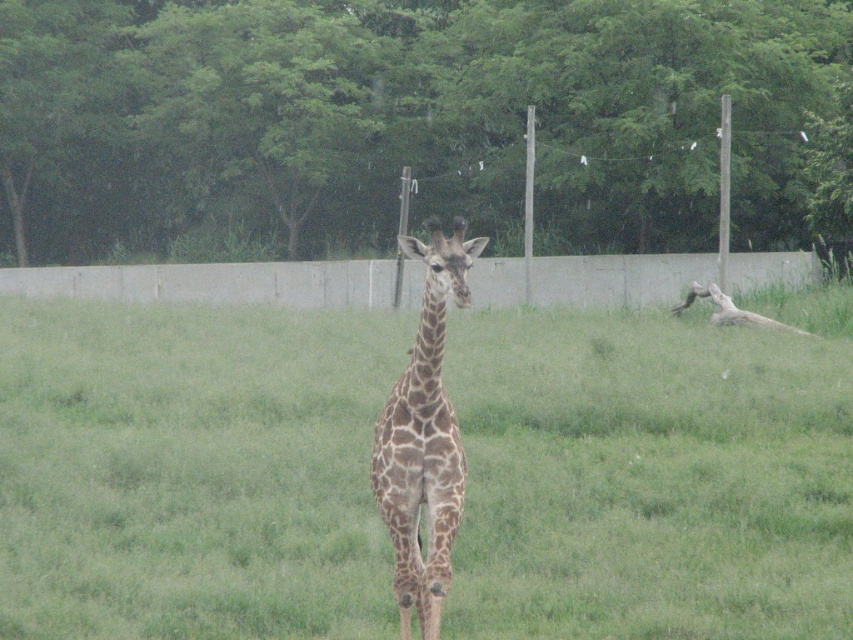
Question: Is green leafy tree at upper center further to the viewer compared to gray concrete fence at center?

Choices:
 (A) yes
 (B) no

Answer: (A)

Question: From the image, what is the correct spatial relationship of gray concrete fence at center in relation to brown spotted giraffe at center?

Choices:
 (A) right
 (B) left

Answer: (B)

Question: Which of these objects is positioned farthest from the brown textured grass at center?

Choices:
 (A) green leafy tree at upper center
 (B) gray concrete fence at center

Answer: (A)

Question: Based on their relative distances, which object is farther from the green leafy tree at upper center?

Choices:
 (A) brown spotted giraffe at center
 (B) gray concrete fence at center

Answer: (A)

Question: Can you confirm if brown textured grass at center is positioned above green leafy tree at upper center?

Choices:
 (A) yes
 (B) no

Answer: (B)

Question: Which of the following is the closest to the observer?

Choices:
 (A) brown spotted giraffe at center
 (B) green leafy tree at upper center
 (C) gray concrete fence at center
 (D) brown textured grass at center

Answer: (A)